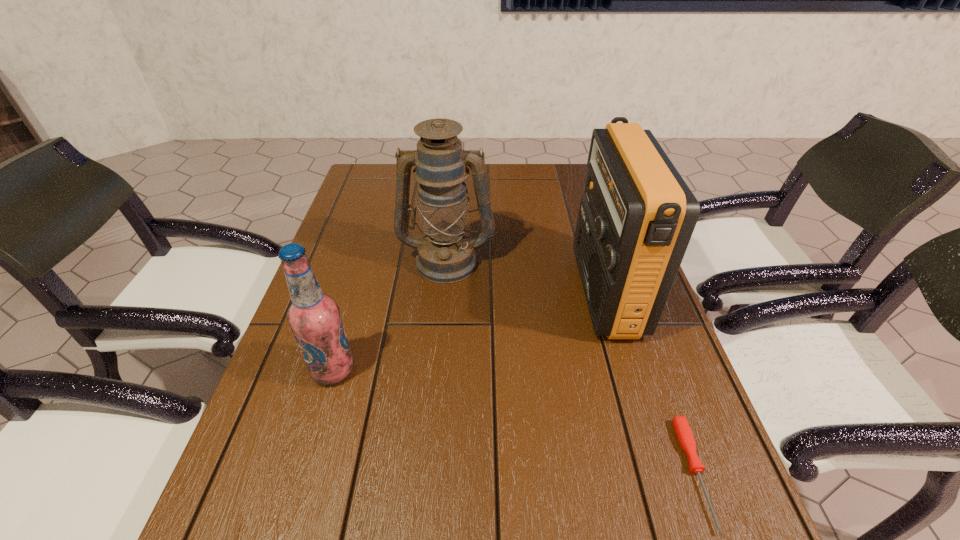
Locate an element on the screen. object identified as the second closest to the leftmost object is located at coordinates (636, 218).

Locate an element on the screen. The width and height of the screenshot is (960, 540). object that is the closest to the oil lamp is located at coordinates (636, 218).